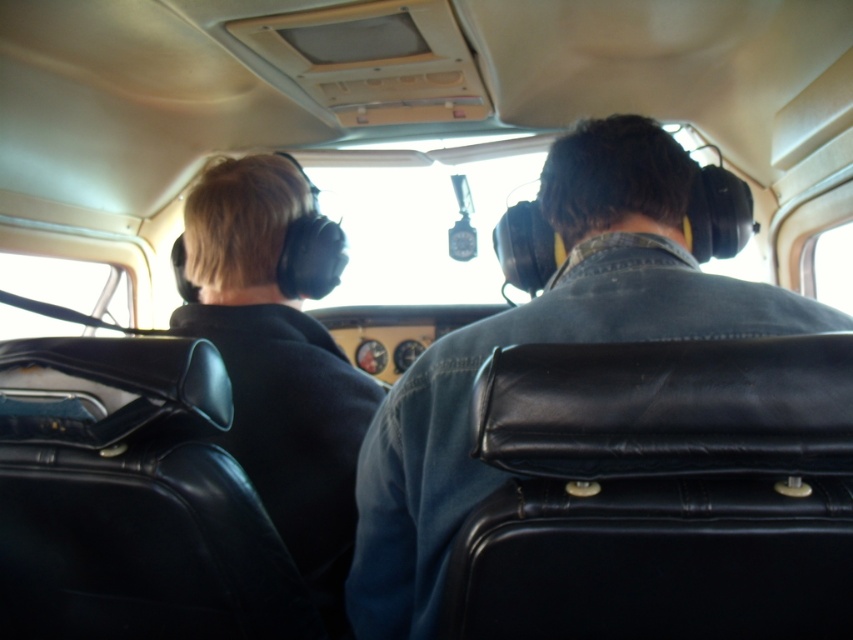
You are a flight attendant checking luggage dimensions. The airline requires that the width of the luggage must not exceed the width of the passenger seat. You observe the black leather suitcase at center and the denim jacket at center in the cockpit. Which item has a smaller width and would be more likely to comply with the luggage size restrictions?

The black leather suitcase at center has a smaller width than the denim jacket at center, so it would comply with the luggage size restrictions.

Looking at this image, you are a flight attendant who needs to retrieve a first aid kit stored in the black leather suitcase at center. However, your denim jacket at center is blocking access. Can you reach the suitcase without moving the jacket?

The distance between the black leather suitcase at center and the denim jacket at center is 8.94 inches. Since the jacket is blocking access, you would need to move it to reach the suitcase.

You are a passenger in the back seat of the aircraft cockpit. You need to place your black leather suitcase at center and denim jacket at center into the overhead compartment. The compartment has a height limit of 20 cm. Which item might not fit based on their heights?

The denim jacket at center is taller than the black leather suitcase at center, so the denim jacket at center might not fit into the overhead compartment with a 20 cm height limit.